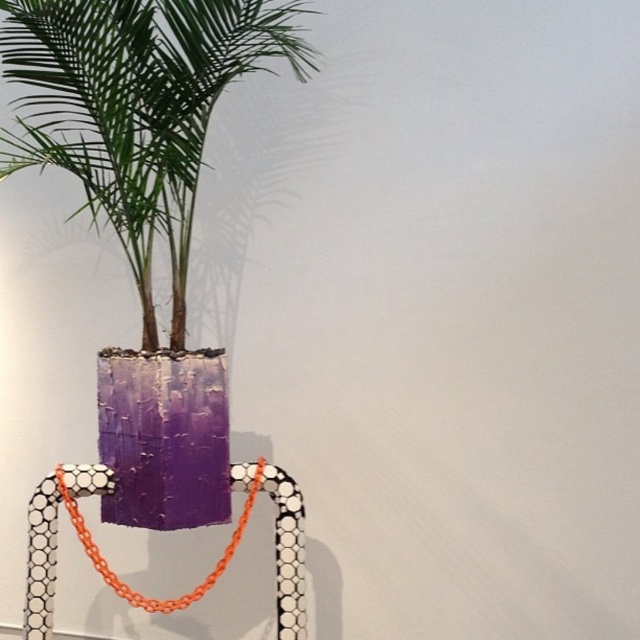
You are an interior designer arranging items on a shelf. You have the purple textured planter at center and the orange plastic necklace at center. Which item should you place higher up to ensure the taller object is visible above the shorter one?

The purple textured planter at center is taller than the orange plastic necklace at center, so place the purple textured planter at center higher up so it can be seen above the orange plastic necklace at center.

You are an interior designer arranging items in a room. You have a purple textured planter at center and an orange plastic necklace at center. Based on their positions, which item should you place higher to maintain the current arrangement?

The purple textured planter at center should be placed higher since it is currently located above the orange plastic necklace at center.

You are an interior designer arranging items in a room. You have a purple textured planter at center and an orange plastic necklace at center. According to the scene, which object is positioned to the left?

The purple textured planter at center is to the left of the orange plastic necklace at center, so the purple textured planter at center is positioned to the left.